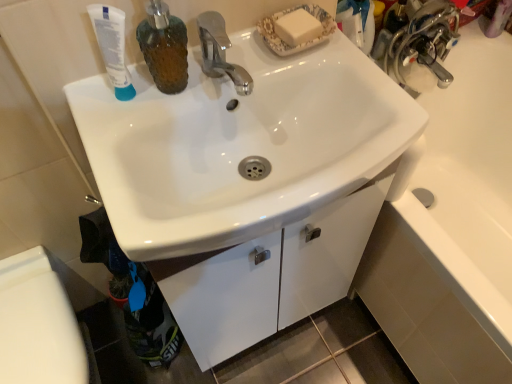
Question: Is white glossy cabinet at lower center taller than white matte tube at upper left?

Choices:
 (A) no
 (B) yes

Answer: (A)

Question: Considering the relative sizes of white glossy cabinet at lower center and white matte tube at upper left in the image provided, is white glossy cabinet at lower center wider than white matte tube at upper left?

Choices:
 (A) no
 (B) yes

Answer: (B)

Question: Considering the relative positions of white glossy cabinet at lower center and white matte tube at upper left in the image provided, is white glossy cabinet at lower center to the right of white matte tube at upper left from the viewer's perspective?

Choices:
 (A) yes
 (B) no

Answer: (A)

Question: Is white glossy cabinet at lower center positioned far away from white matte tube at upper left?

Choices:
 (A) yes
 (B) no

Answer: (B)

Question: Considering the relative sizes of white glossy cabinet at lower center and white matte tube at upper left in the image provided, is white glossy cabinet at lower center thinner than white matte tube at upper left?

Choices:
 (A) no
 (B) yes

Answer: (A)

Question: In the image, is white glossy cabinet at lower center on the left side or the right side of white matte tube at upper left?

Choices:
 (A) left
 (B) right

Answer: (B)

Question: From a real-world perspective, is white glossy cabinet at lower center positioned above or below white matte tube at upper left?

Choices:
 (A) above
 (B) below

Answer: (B)

Question: From the image's perspective, is white glossy cabinet at lower center above or below white matte tube at upper left?

Choices:
 (A) below
 (B) above

Answer: (A)

Question: Considering the positions of point (257, 314) and point (118, 41), is point (257, 314) closer or farther from the camera than point (118, 41)?

Choices:
 (A) farther
 (B) closer

Answer: (A)

Question: Considering the relative positions of white glossy sink at center and brown textured soap dispenser at upper left in the image provided, is white glossy sink at center to the left or to the right of brown textured soap dispenser at upper left?

Choices:
 (A) right
 (B) left

Answer: (A)

Question: In terms of size, does white glossy sink at center appear bigger or smaller than brown textured soap dispenser at upper left?

Choices:
 (A) small
 (B) big

Answer: (B)

Question: Considering their positions, is white glossy sink at center located in front of or behind brown textured soap dispenser at upper left?

Choices:
 (A) behind
 (B) front

Answer: (B)

Question: Is white glossy sink at center situated inside brown textured soap dispenser at upper left or outside?

Choices:
 (A) outside
 (B) inside

Answer: (A)

Question: From the image's perspective, relative to white glossy toilet bowl at lower left, is white matte tube at upper left above or below?

Choices:
 (A) above
 (B) below

Answer: (A)

Question: Visually, is white matte tube at upper left positioned to the left or to the right of white glossy toilet bowl at lower left?

Choices:
 (A) left
 (B) right

Answer: (B)